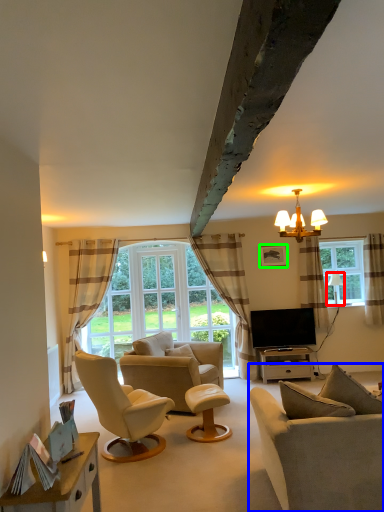
Question: Which object is positioned closest to lamp (highlighted by a red box)? Select from studio couch (highlighted by a blue box) and picture frame (highlighted by a green box).

Choices:
 (A) studio couch
 (B) picture frame

Answer: (B)